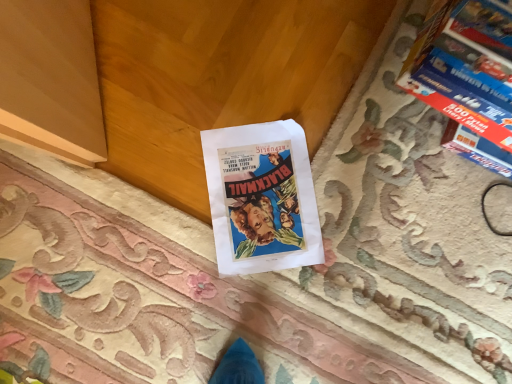
The height and width of the screenshot is (384, 512). In order to click on space that is in front of blue glossy book at upper right in this screenshot , I will do `click(397, 200)`.